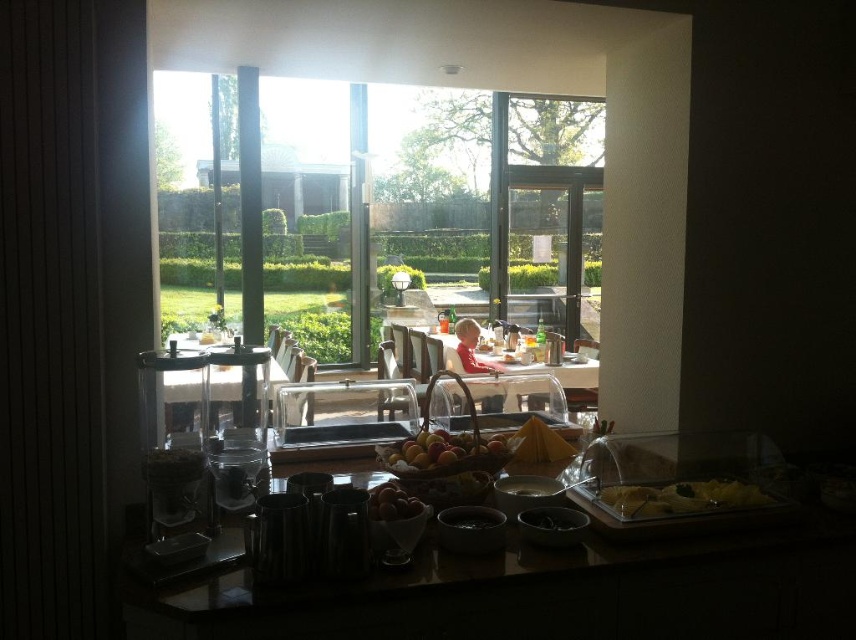
Is transparent glass door at center shorter than glossy wooden fruit basket at center?

No, transparent glass door at center is not shorter than glossy wooden fruit basket at center.

Measure the distance between transparent glass door at center and camera.

The distance of transparent glass door at center from camera is 7.59 meters.

The width and height of the screenshot is (856, 640). Find the location of `transparent glass door at center`. transparent glass door at center is located at coordinates (544, 248).

Does transparent glass window at center appear over glossy wooden fruit basket at center?

Correct, transparent glass window at center is located above glossy wooden fruit basket at center.

Find the location of a particular element. transparent glass window at center is located at coordinates (421, 212).

Does point (235, 307) come farther from viewer compared to point (474, 451)?

Yes, it is behind point (474, 451).

Locate an element on the screen. The image size is (856, 640). transparent glass window at center is located at coordinates (421, 212).

Who is more distant from viewer, (440, 172) or (528, 337)?

The point (440, 172) is behind.

Is point (449, 150) positioned before point (575, 371)?

No, it is not.

Between point (218, 280) and point (581, 374), which one is positioned in front?

Positioned in front is point (581, 374).

You are a GUI agent. You are given a task and a screenshot of the screen. Output one action in this format:
    pyautogui.click(x=<x>, y=<y>)
    Task: Click on the transparent glass window at center
    
    Given the screenshot: What is the action you would take?
    pyautogui.click(x=421, y=212)